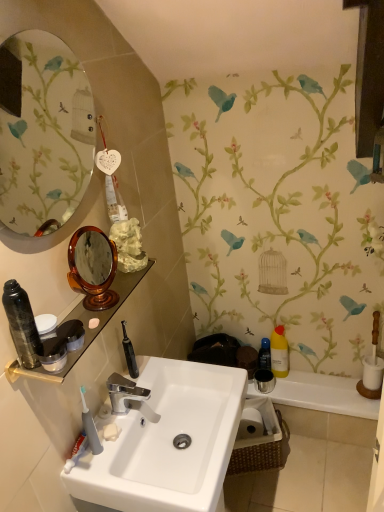
Identify the location of unoccupied area in front of yellow translucent bottle at right, arranged as the 1th toiletry when viewed from the right. The height and width of the screenshot is (512, 384). (306, 391).